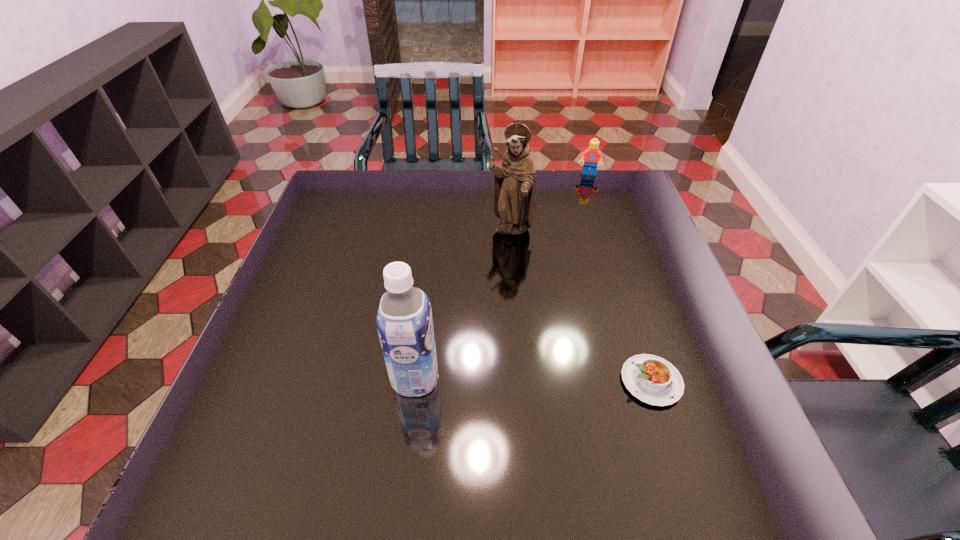
Where is `blank space located on the front-facing side of the second farthest object`? The height and width of the screenshot is (540, 960). blank space located on the front-facing side of the second farthest object is located at coordinates (521, 283).

I want to click on blank space located 0.230m on the front-facing side of the second farthest object, so click(x=527, y=307).

At what (x,y) coordinates should I click in order to perform the action: click on vacant space located 0.210m on the front-facing side of the second farthest object. Please return your answer as a coordinate pair (x, y). This screenshot has width=960, height=540. Looking at the image, I should click on (525, 301).

Identify the location of blank space located on the face of the Lego. (579, 255).

Locate an element on the screen. The height and width of the screenshot is (540, 960). blank space located 0.090m on the face of the Lego is located at coordinates (586, 193).

Image resolution: width=960 pixels, height=540 pixels. Find the location of `free point located on the face of the Lego`. free point located on the face of the Lego is located at coordinates pos(581,241).

Find the location of `object at the far edge`. object at the far edge is located at coordinates (591, 156).

Find the location of `soya milk at the near edge`. soya milk at the near edge is located at coordinates (404, 320).

Where is `pudding positioned at the near edge`? This screenshot has height=540, width=960. pudding positioned at the near edge is located at coordinates (653, 380).

I want to click on pudding positioned at the right edge, so click(653, 380).